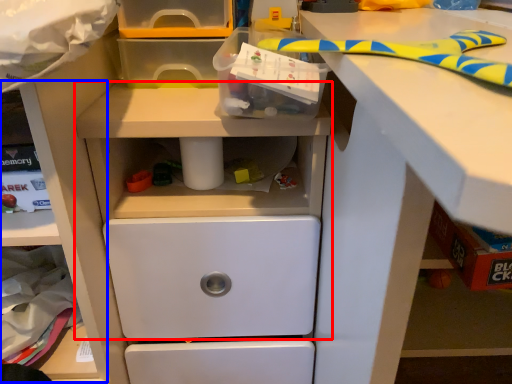
Question: Among these objects, which one is farthest to the camera, workbench (highlighted by a red box) or shelf (highlighted by a blue box)?

Choices:
 (A) workbench
 (B) shelf

Answer: (B)